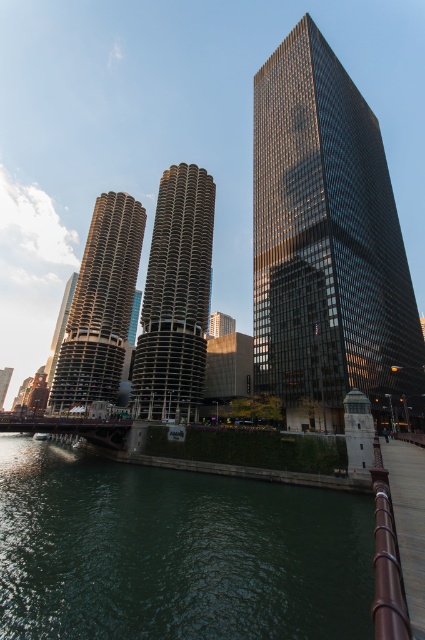
Question: Which point is farther to the camera?

Choices:
 (A) gold textured building at center
 (B) metallic gray boat at lower left
 (C) marble-patterned building at center

Answer: (A)

Question: Which object is positioned farthest from the gold textured building at center?

Choices:
 (A) metallic gray boat at lower left
 (B) matte glass skyscraper at center

Answer: (B)

Question: Is green water at lower left to the right of metallic gray boat at lower left from the viewer's perspective?

Choices:
 (A) yes
 (B) no

Answer: (A)

Question: Does marble-patterned building at center lie behind gold textured building at center?

Choices:
 (A) yes
 (B) no

Answer: (B)

Question: Among these points, which one is farthest from the camera?

Choices:
 (A) (280, 141)
 (B) (152, 396)

Answer: (A)

Question: Where is marble-patterned building at center located in relation to matte glass skyscraper at center in the image?

Choices:
 (A) above
 (B) below

Answer: (A)